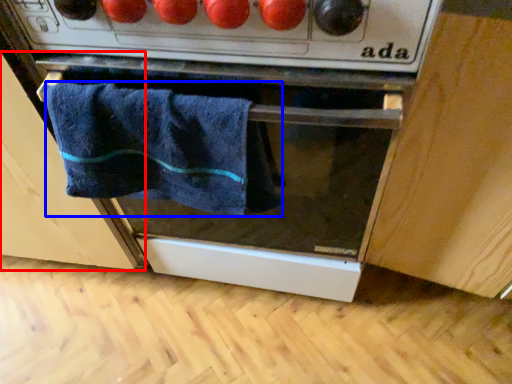
Question: Which object appears farthest to the camera in this image, cabinetry (highlighted by a red box) or towel (highlighted by a blue box)?

Choices:
 (A) cabinetry
 (B) towel

Answer: (A)